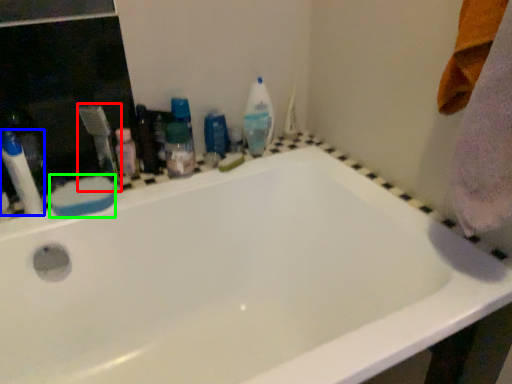
Question: Which object is the farthest from toothbrush (highlighted by a red box)? Choose among these: toiletry (highlighted by a blue box) or soap (highlighted by a green box).

Choices:
 (A) toiletry
 (B) soap

Answer: (A)